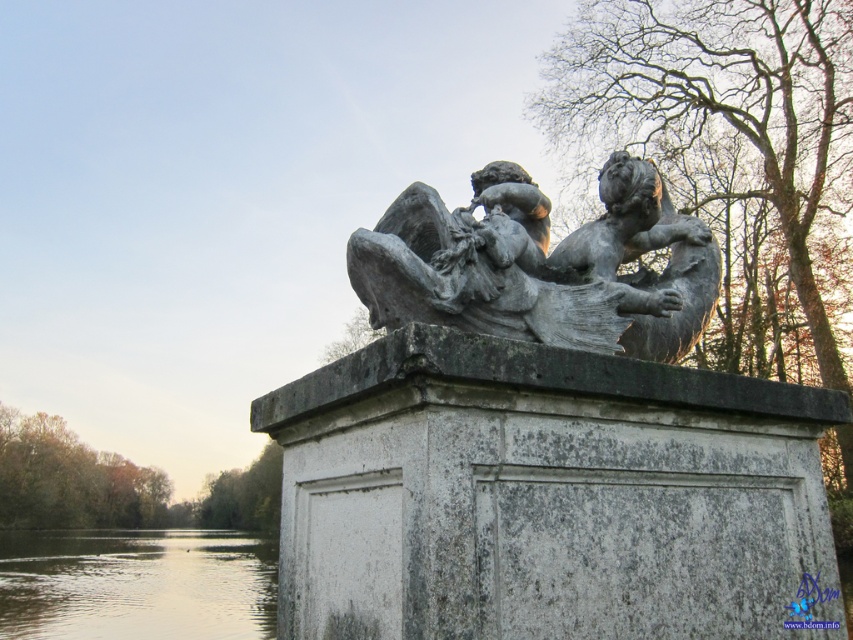
Question: Can you confirm if gray stone cherubim at center is positioned to the right of smooth water at lower left?

Choices:
 (A) yes
 (B) no

Answer: (A)

Question: Among these objects, which one is farthest from the camera?

Choices:
 (A) smooth water at lower left
 (B) gray stone cherubim at center

Answer: (A)

Question: Does gray stone cherubim at center appear on the right side of smooth water at lower left?

Choices:
 (A) yes
 (B) no

Answer: (A)

Question: Where is gray stone cherubim at center located in relation to smooth water at lower left in the image?

Choices:
 (A) right
 (B) left

Answer: (A)